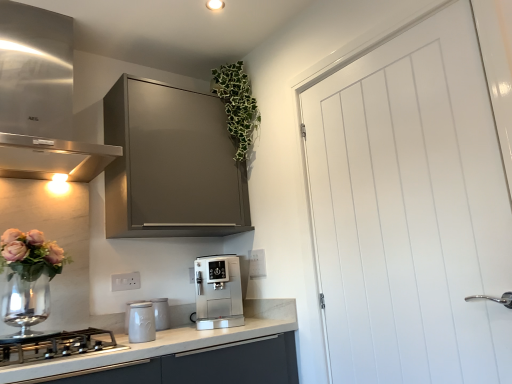
Find the location of a particular element. This screenshot has width=512, height=384. vacant region above stainless steel range hood at upper left (from a real-world perspective) is located at coordinates (61, 30).